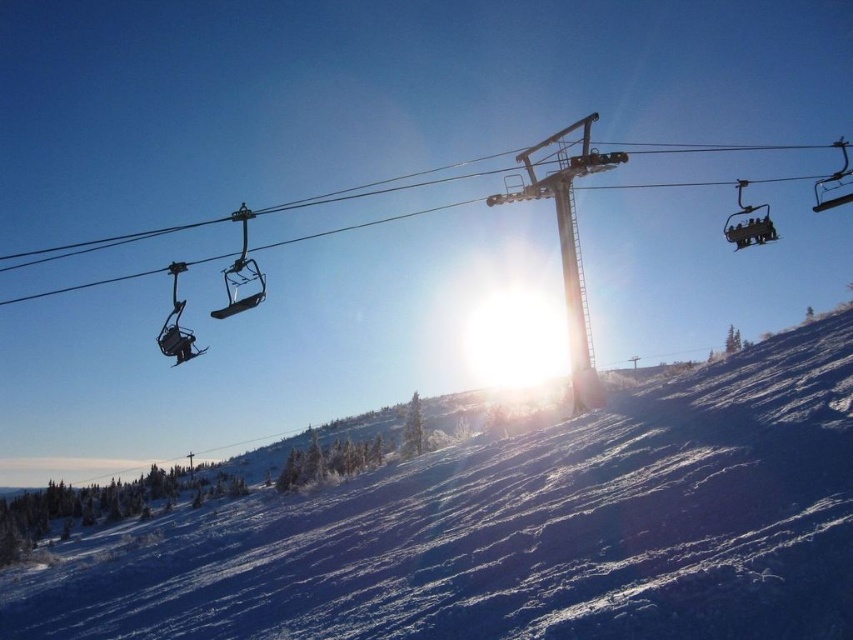
Which is behind, point (669, 506) or point (767, 225)?

The point (767, 225) is behind.

Is white powdery snow at center positioned before metallic gray ski lift at upper right?

Yes, it is in front of metallic gray ski lift at upper right.

Locate an element on the screen. Image resolution: width=853 pixels, height=640 pixels. white powdery snow at center is located at coordinates (523, 531).

Between point (254, 300) and point (749, 234), which one is positioned in front?

Point (254, 300) is in front.

Measure the distance between point (x=259, y=280) and camera.

They are 630.36 feet apart.

Locate an element on the screen. metallic black ski lift at center-left is located at coordinates (241, 273).

Is white powdery snow at center wider than metallic black ski lift at center-left?

Correct, the width of white powdery snow at center exceeds that of metallic black ski lift at center-left.

Which is more to the right, white powdery snow at center or metallic black ski lift at center-left?

white powdery snow at center

This screenshot has width=853, height=640. What do you see at coordinates (523, 531) in the screenshot?
I see `white powdery snow at center` at bounding box center [523, 531].

I want to click on white powdery snow at center, so click(523, 531).